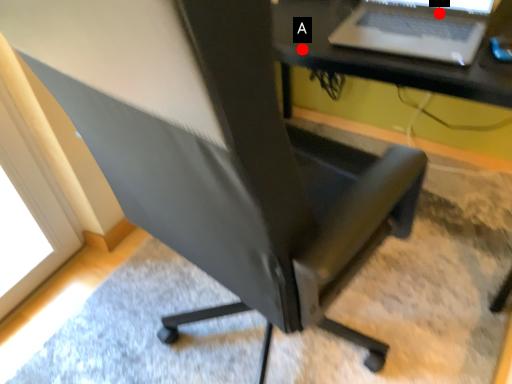
Question: Two points are circled on the image, labeled by A and B beside each circle. Which point is farther from the camera taking this photo?

Choices:
 (A) A is further
 (B) B is further

Answer: (B)